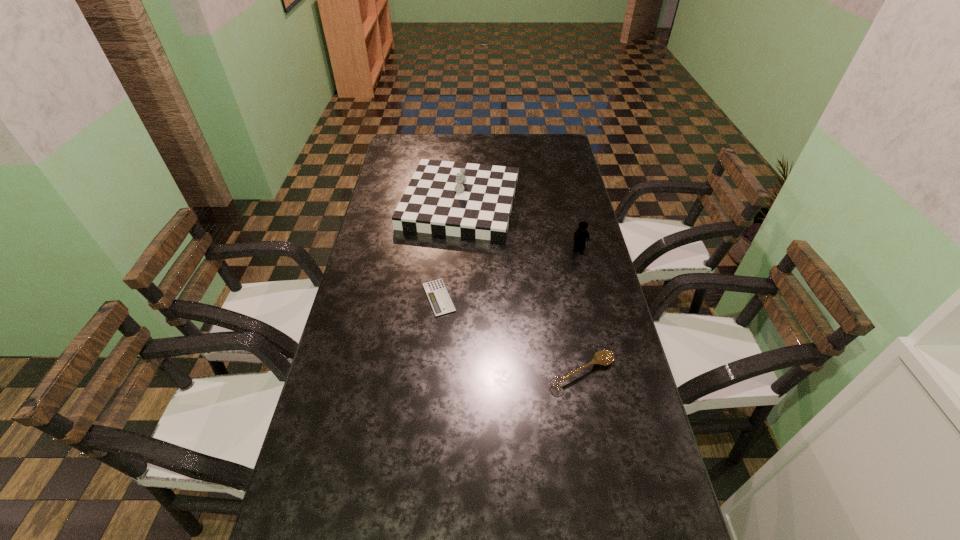
Locate an element on the screen. The height and width of the screenshot is (540, 960). vacant point located between the second nearest object and the tallest object is located at coordinates (449, 250).

Identify the location of free space between the calculator and the Lego. (509, 272).

Locate an element on the screen. Image resolution: width=960 pixels, height=540 pixels. empty location between the checkerboard and the calculator is located at coordinates (449, 250).

At what (x,y) coordinates should I click in order to perform the action: click on vacant point located between the tallest object and the third nearest object. Please return your answer as a coordinate pair (x, y). The width and height of the screenshot is (960, 540). Looking at the image, I should click on (519, 224).

Image resolution: width=960 pixels, height=540 pixels. Find the location of `free spot between the second nearest object and the ladle`. free spot between the second nearest object and the ladle is located at coordinates (511, 335).

Where is `blank region between the Lego and the shortest object`? The image size is (960, 540). blank region between the Lego and the shortest object is located at coordinates (509, 272).

Find the location of a particular element. Image resolution: width=960 pixels, height=540 pixels. vacant area that lies between the second shortest object and the calculator is located at coordinates (511, 335).

The image size is (960, 540). Find the location of `free space between the tallest object and the third nearest object`. free space between the tallest object and the third nearest object is located at coordinates (519, 224).

This screenshot has height=540, width=960. I want to click on free space between the calculator and the nearest object, so coord(511,335).

The image size is (960, 540). I want to click on empty space between the shortest object and the nearest object, so pyautogui.click(x=511, y=335).